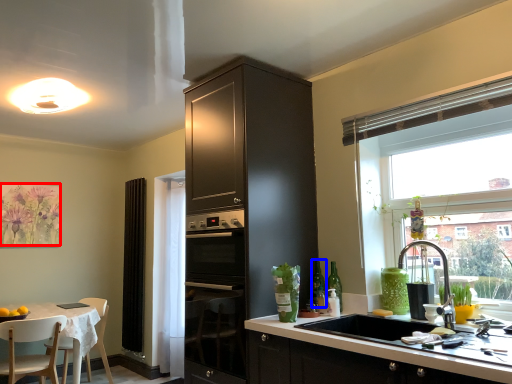
Question: Which of the following is the closest to the observer, flower (highlighted by a red box) or bottle (highlighted by a blue box)?

Choices:
 (A) flower
 (B) bottle

Answer: (B)